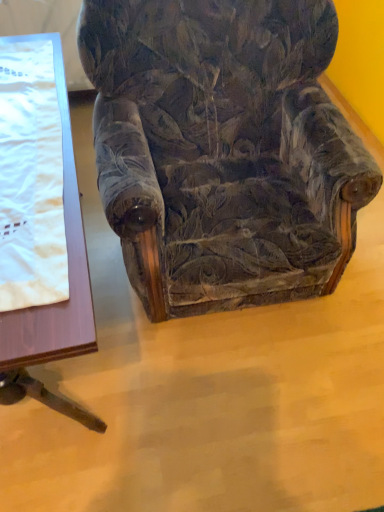
Where is `vacant space to the right of wooden table at left`? This screenshot has height=512, width=384. vacant space to the right of wooden table at left is located at coordinates (257, 385).